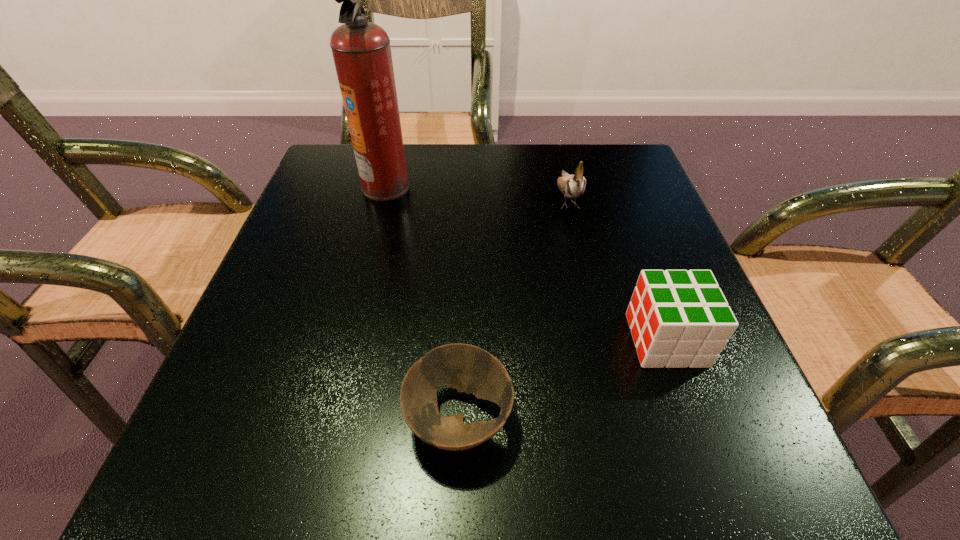
What are the coordinates of `the leftmost object` in the screenshot? It's located at (361, 50).

This screenshot has height=540, width=960. In order to click on the tallest object in this screenshot , I will do `click(361, 50)`.

You are a GUI agent. You are given a task and a screenshot of the screen. Output one action in this format:
    pyautogui.click(x=<x>, y=<y>)
    Task: Click on the bird
    
    Given the screenshot: What is the action you would take?
    pos(572,186)

Image resolution: width=960 pixels, height=540 pixels. Find the location of `the second object from right to left`. the second object from right to left is located at coordinates (572, 186).

Identify the location of the rightmost object. (678, 318).

You are a GUI agent. You are given a task and a screenshot of the screen. Output one action in this format:
    pyautogui.click(x=<x>, y=<y>)
    Task: Click on the cube
    Image resolution: width=960 pixels, height=540 pixels.
    Given the screenshot: What is the action you would take?
    pyautogui.click(x=678, y=318)

Identify the location of the nearest object. Image resolution: width=960 pixels, height=540 pixels. (469, 369).

I want to click on the third object from right to left, so click(x=469, y=369).

Where is `blank area located 0.140m at the nozzle of the tallest object`? blank area located 0.140m at the nozzle of the tallest object is located at coordinates (473, 187).

Locate an element on the screen. The image size is (960, 540). free spot located at the face of the second tallest object is located at coordinates (579, 246).